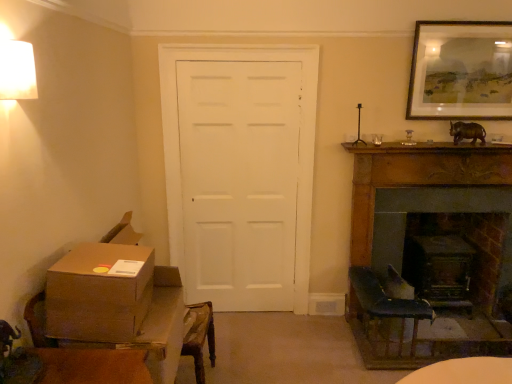
Find the location of a particular element. free location to the right of white matte door at center is located at coordinates (307, 334).